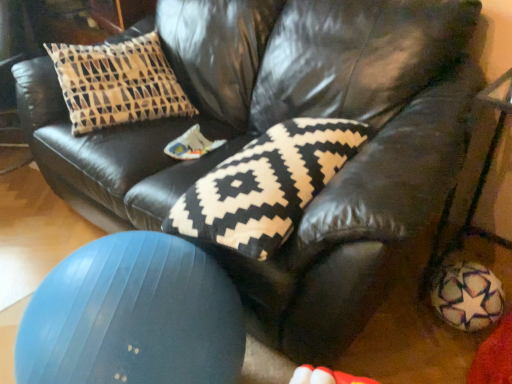
Question: Does point (295, 185) appear closer or farther from the camera than point (28, 375)?

Choices:
 (A) closer
 (B) farther

Answer: (B)

Question: From a real-world perspective, is black and white knitted pillow at center physically located above or below blue rubber ball at lower left?

Choices:
 (A) above
 (B) below

Answer: (A)

Question: Is black and white knitted pillow at center situated inside blue rubber ball at lower left or outside?

Choices:
 (A) outside
 (B) inside

Answer: (A)

Question: In the image, is blue rubber ball at lower left positioned in front of or behind black and white knitted pillow at center?

Choices:
 (A) front
 (B) behind

Answer: (A)

Question: From a real-world perspective, is blue rubber ball at lower left positioned above or below black and white knitted pillow at center?

Choices:
 (A) above
 (B) below

Answer: (B)

Question: From their relative heights in the image, would you say blue rubber ball at lower left is taller or shorter than black and white knitted pillow at center?

Choices:
 (A) short
 (B) tall

Answer: (B)

Question: Does point (53, 362) appear closer or farther from the camera than point (223, 162)?

Choices:
 (A) closer
 (B) farther

Answer: (A)